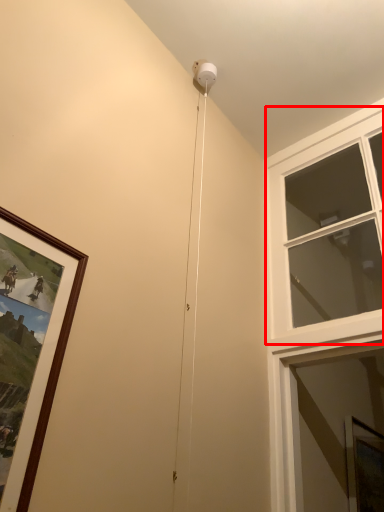
Question: From the image's perspective, where is window (annotated by the red box) located relative to window screen?

Choices:
 (A) above
 (B) below

Answer: (A)